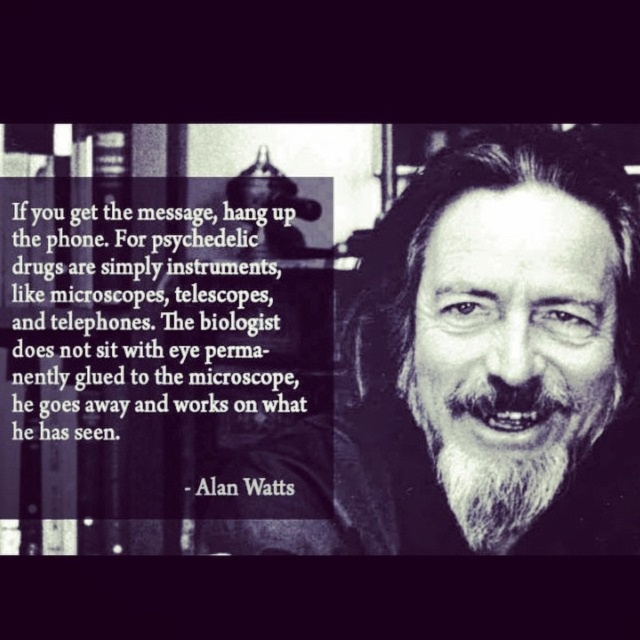
Is white beard at right smaller than black paper at upper left?

No, white beard at right is not smaller than black paper at upper left.

Is point (362, 444) positioned before point (51, 252)?

No, it is behind (51, 252).

Find the location of `white beard at right`. white beard at right is located at coordinates (472, 372).

Which is below, white beard at right or white fuzzy beard at center?

Positioned lower is white beard at right.

Can you confirm if white beard at right is smaller than white fuzzy beard at center?

No.

Does point (461, 426) come farther from viewer compared to point (476, 461)?

Yes, point (461, 426) is farther from viewer.

Where is `white beard at right`? Image resolution: width=640 pixels, height=640 pixels. white beard at right is located at coordinates coord(472,372).

Is black paper at upper left positioned behind white fuzzy beard at center?

Yes, black paper at upper left is behind white fuzzy beard at center.

Who is lower down, black paper at upper left or white fuzzy beard at center?

white fuzzy beard at center

Between point (17, 308) and point (492, 406), which one is positioned in front?

Point (492, 406) is in front.

Locate an element on the screen. This screenshot has width=640, height=640. black paper at upper left is located at coordinates (166, 310).